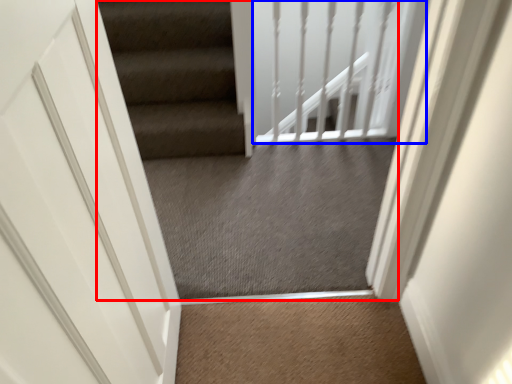
Question: Which object appears farthest to the camera in this image, escalator (highlighted by a red box) or balustrade (highlighted by a blue box)?

Choices:
 (A) escalator
 (B) balustrade

Answer: (B)